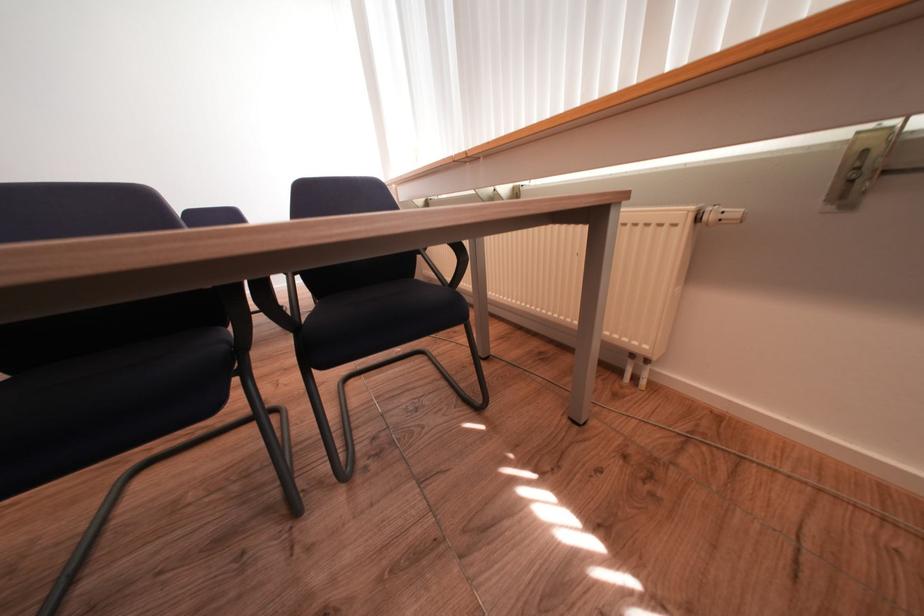
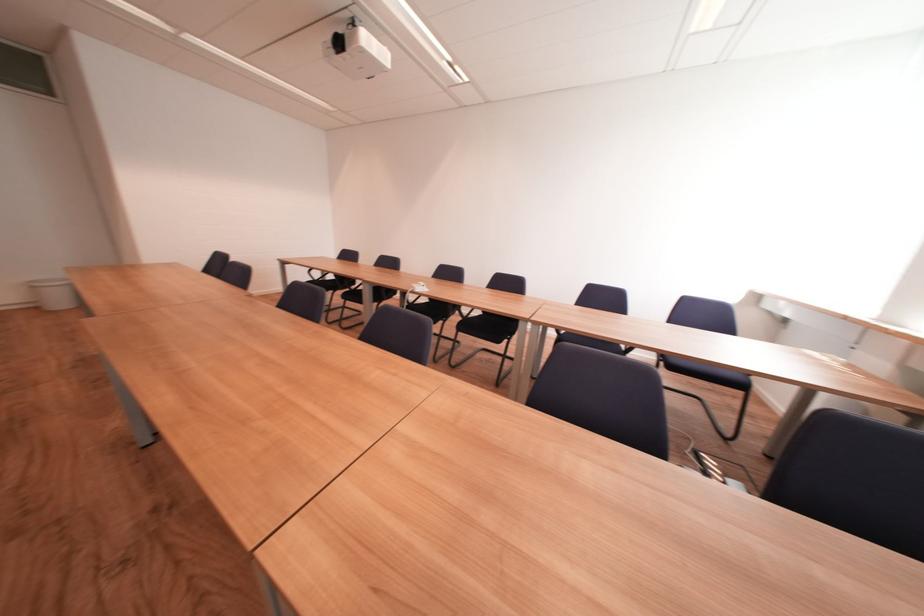
Question: Based on the continuous images, in which direction is the camera rotating? Reply with the corresponding letter.

Choices:
 (A) Left
 (B) Right
 (C) Up
 (D) Down

Answer: (A)